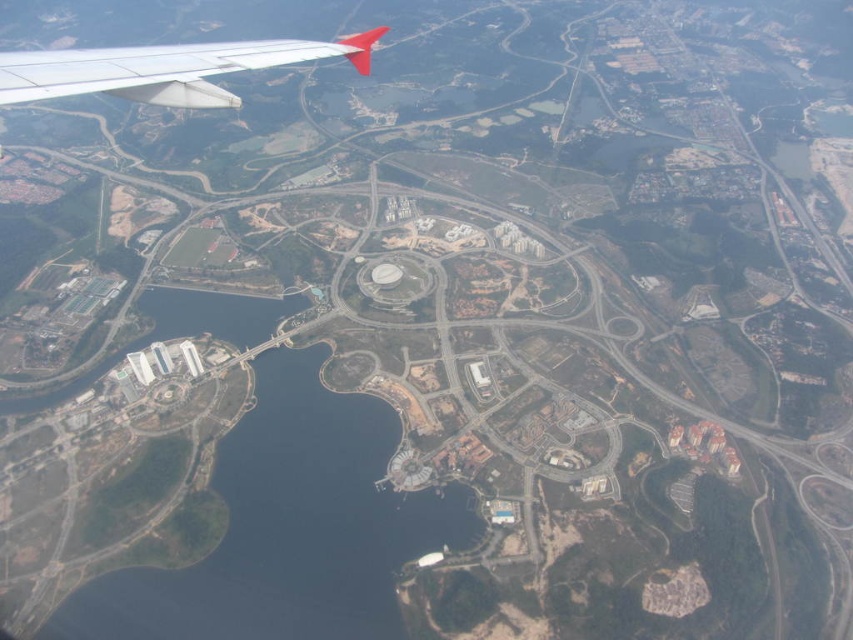
You are a pilot flying an airplane and you notice the blue water at center and the white matte wing at upper left in your view. Which object is positioned lower in your field of view?

The blue water at center is positioned lower in the field of view as it is described to be below the white matte wing at upper left.

You are a pilot flying over an urban area and notice the blue water at center and the white matte wing at upper left in your view. Which object appears smaller in height from your perspective?

The blue water at center appears smaller in height than the white matte wing at upper left because it is not as tall.